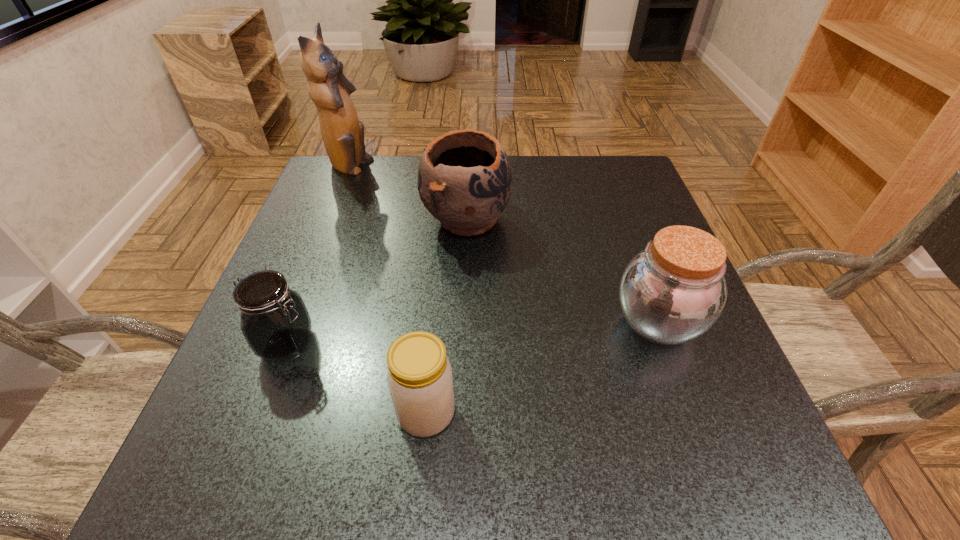
Where is `vacant space that satisfies the following two spatial constraints: 1. on the face of the second jar from right to left; 2. on the left side of the tallest object`? vacant space that satisfies the following two spatial constraints: 1. on the face of the second jar from right to left; 2. on the left side of the tallest object is located at coordinates (252, 413).

Identify the location of free space that satisfies the following two spatial constraints: 1. on the back side of the nearest jar; 2. on the face of the tallest object. (449, 167).

Identify the location of free space that satisfies the following two spatial constraints: 1. on the lid of the leftmost jar; 2. on the right side of the second jar from right to left. (262, 413).

Locate an element on the screen. vacant space that satisfies the following two spatial constraints: 1. on the back side of the pottery; 2. on the face of the cat is located at coordinates (468, 167).